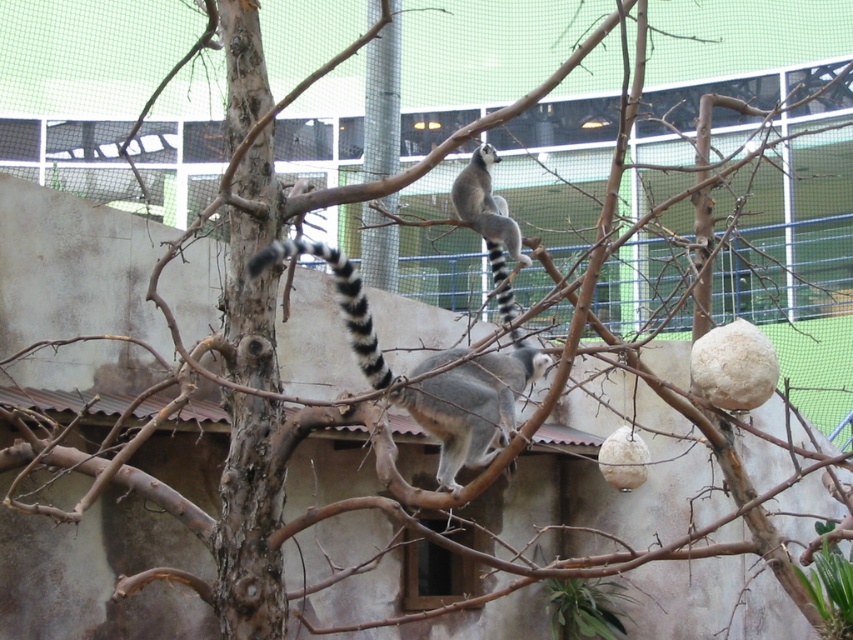
You are a zookeeper trying to locate two specific points in the zoo enclosure for maintenance. The first point is at coordinate point [502,305], and the second is at point [305,248]. From your vantage point, which point is closer to you?

Point [305,248] is closer to you because point [502,305] is behind it.